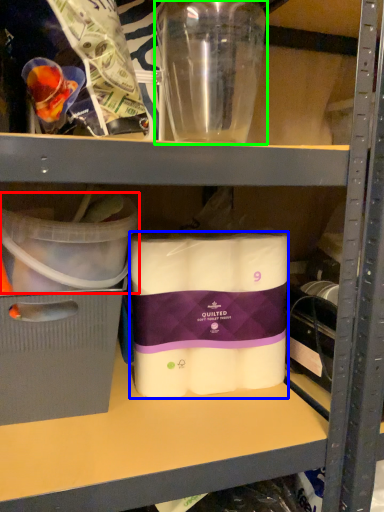
Question: Considering the real-world distances, which object is farthest from storage box (highlighted by a red box)? toilet paper (highlighted by a blue box) or bottle (highlighted by a green box)?

Choices:
 (A) toilet paper
 (B) bottle

Answer: (B)